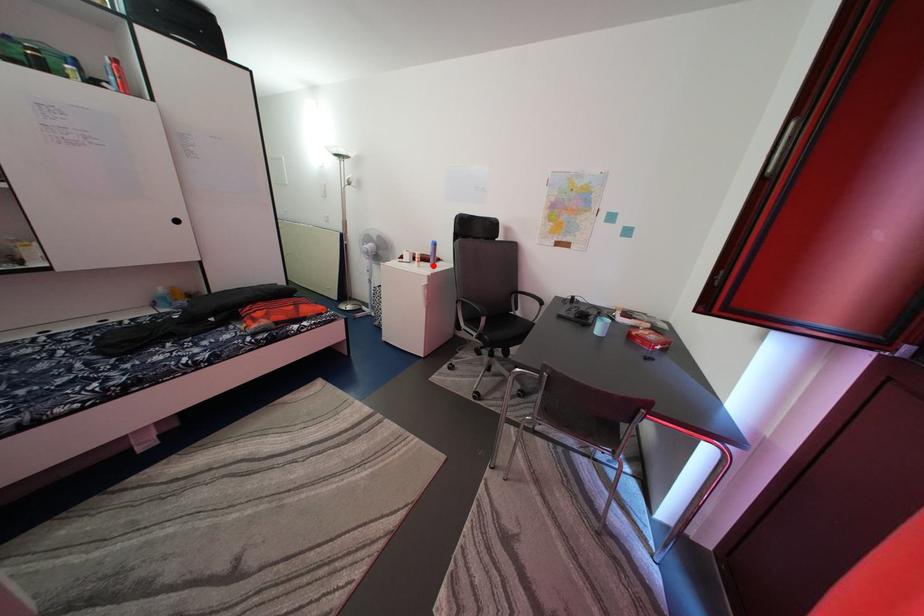
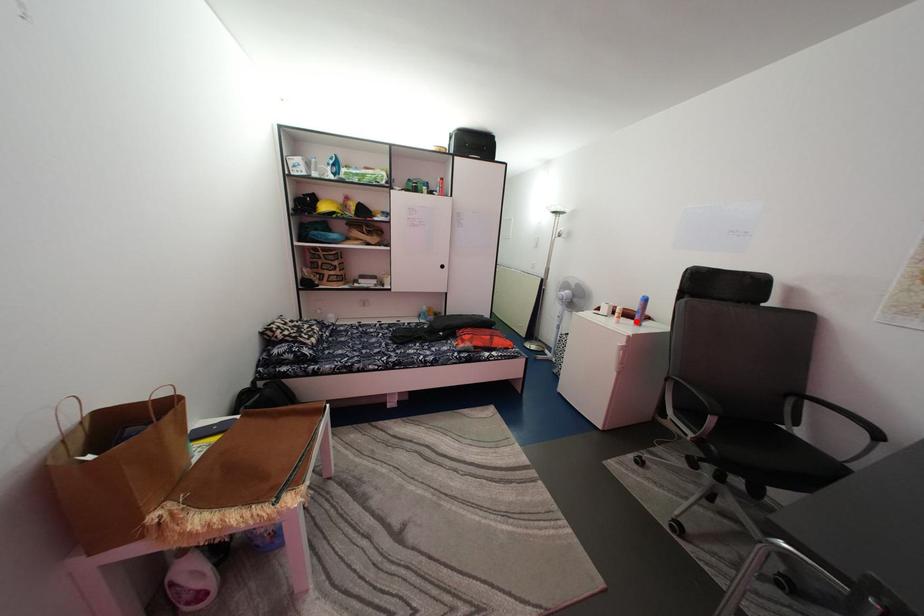
I am providing you with two images of the same scene from different viewpoints. A red point is marked on the first image and another point is marked on the second image. Do the highlighted points in image1 and image2 indicate the same real-world spot?

Yes